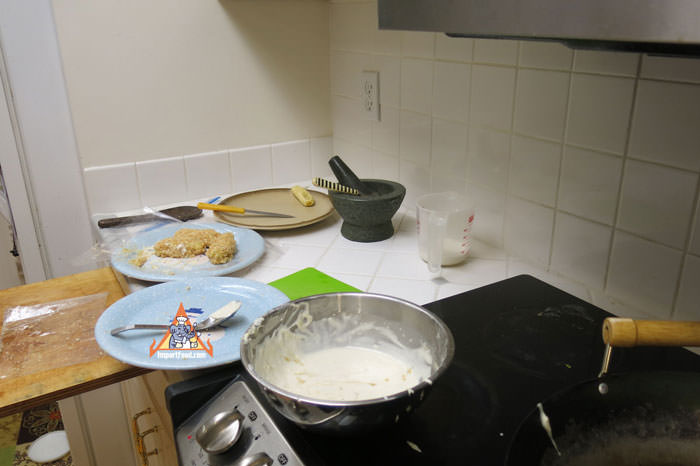
You are a GUI agent. You are given a task and a screenshot of the screen. Output one action in this format:
    pyautogui.click(x=<x>, y=<y>)
    Task: Click on the fan
    The image size is (700, 466).
    Given the screenshot: What is the action you would take?
    pyautogui.click(x=507, y=20)